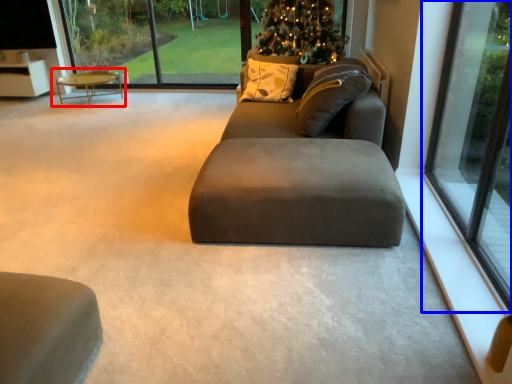
Question: Which of the following is the closest to the observer, coffee table (highlighted by a red box) or window (highlighted by a blue box)?

Choices:
 (A) coffee table
 (B) window

Answer: (B)